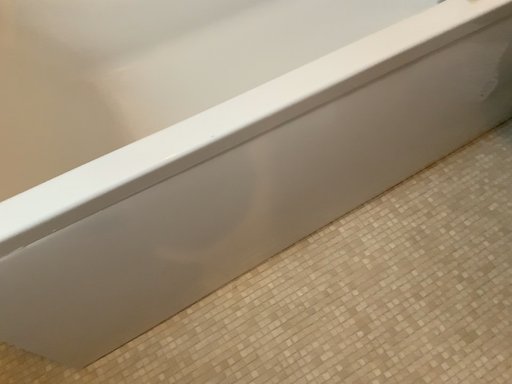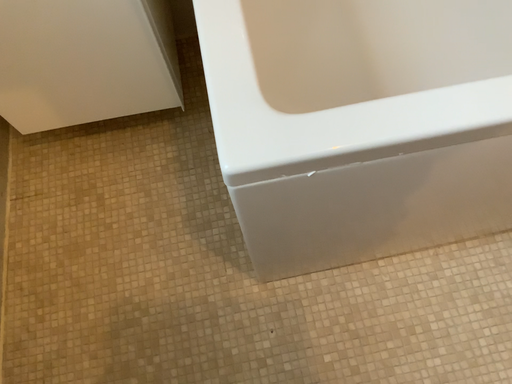
Question: Which way did the camera rotate in the video?

Choices:
 (A) rotated left
 (B) rotated right

Answer: (A)